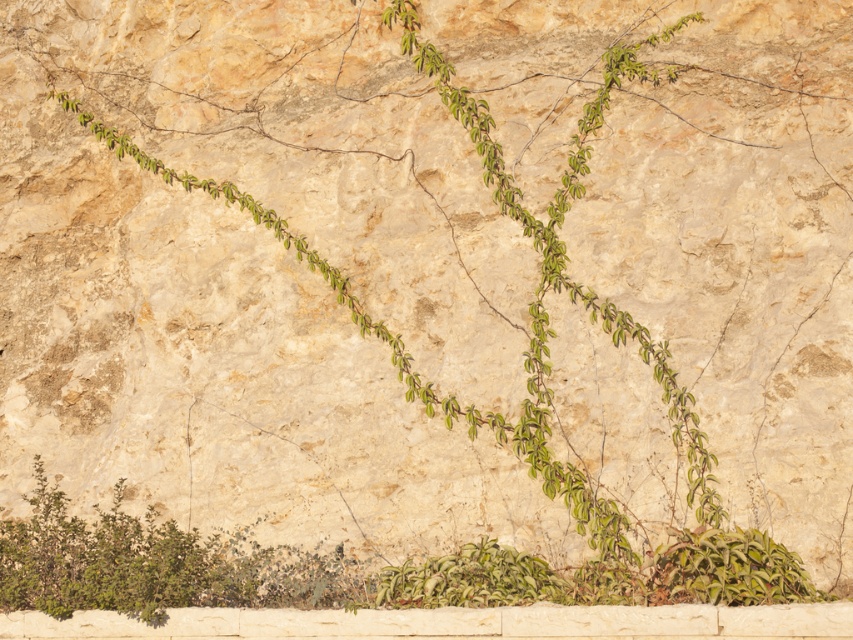
You are standing in front of the stone wall and want to place a small statue between the green leafy bush at lower left and the green leafy plant at lower right. Based on their positions, which plant should the statue be closer to?

The green leafy plant at lower right is behind the green leafy bush at lower left, so the statue should be placed closer to the green leafy bush at lower left since it is in front and closer to the viewer.

You are standing in front of the stone wall and notice two green plants. One is the green leafy bush at lower left and the other is the green leafy plant at lower right. Which one is positioned higher on the wall?

The green leafy bush at lower left is located above the green leafy plant at lower right, so it is positioned higher on the wall.

You are standing 2 meters away from the camera. Can you touch the point at coordinate [138,564]?

The point at coordinate [138,564] is 5.59 meters from the camera. Since you are 2 meters away from the camera, the total distance between you and the point is 5.59 meters minus 2 meters, which is 3.59 meters. Therefore, you cannot reach it.